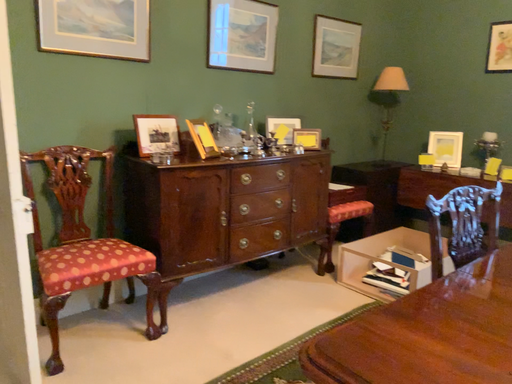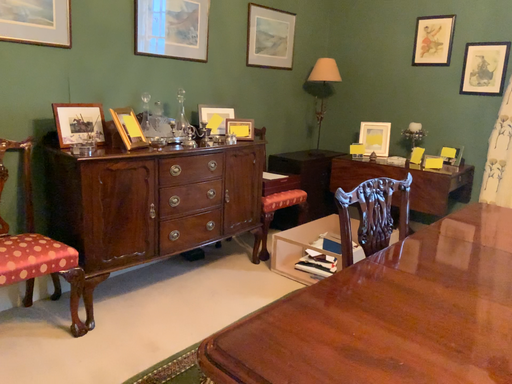
Question: Which way did the camera rotate in the video?

Choices:
 (A) rotated left
 (B) rotated right

Answer: (B)